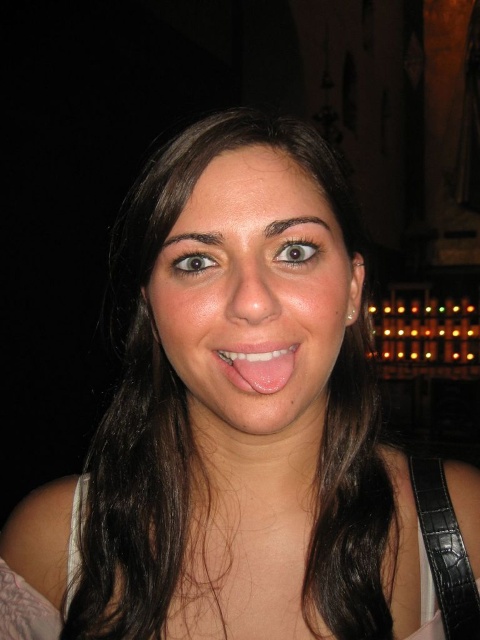
Based on the photo, is black leather strap at lower right to the right of pink glossy tongue at center from the viewer's perspective?

Correct, you'll find black leather strap at lower right to the right of pink glossy tongue at center.

You are a GUI agent. You are given a task and a screenshot of the screen. Output one action in this format:
    pyautogui.click(x=<x>, y=<y>)
    Task: Click on the black leather strap at lower right
    The height and width of the screenshot is (640, 480).
    Given the screenshot: What is the action you would take?
    pyautogui.click(x=444, y=548)

At what (x,y) coordinates should I click in order to perform the action: click on black leather strap at lower right. Please return your answer as a coordinate pair (x, y). Image resolution: width=480 pixels, height=640 pixels. Looking at the image, I should click on (444, 548).